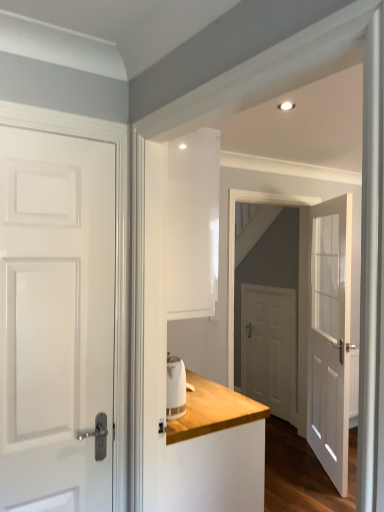
Question: In terms of size, does white glossy door at center appear bigger or smaller than white glass door at center, the 2th door from the back?

Choices:
 (A) small
 (B) big

Answer: (B)

Question: Considering the positions of point (319, 415) and point (322, 419), is point (319, 415) closer or farther from the camera than point (322, 419)?

Choices:
 (A) farther
 (B) closer

Answer: (A)

Question: Estimate the real-world distances between objects in this image. Which object is closer to the white glossy kettle at center?

Choices:
 (A) white wood dresser at center
 (B) white glass door at center, the 2th door from the back
 (C) white glossy door at left, the third door from the back
 (D) white matte door at center, which appears as the second door when viewed from the left
 (E) white glossy door at center

Answer: (A)

Question: Which of these objects is positioned closest to the white glossy door at left, positioned as the first door in front-to-back order?

Choices:
 (A) white glossy door at center
 (B) white glass door at center, the 2th door from the back
 (C) white glossy kettle at center
 (D) white matte door at center, which appears as the second door when viewed from the left
 (E) white wood dresser at center

Answer: (C)